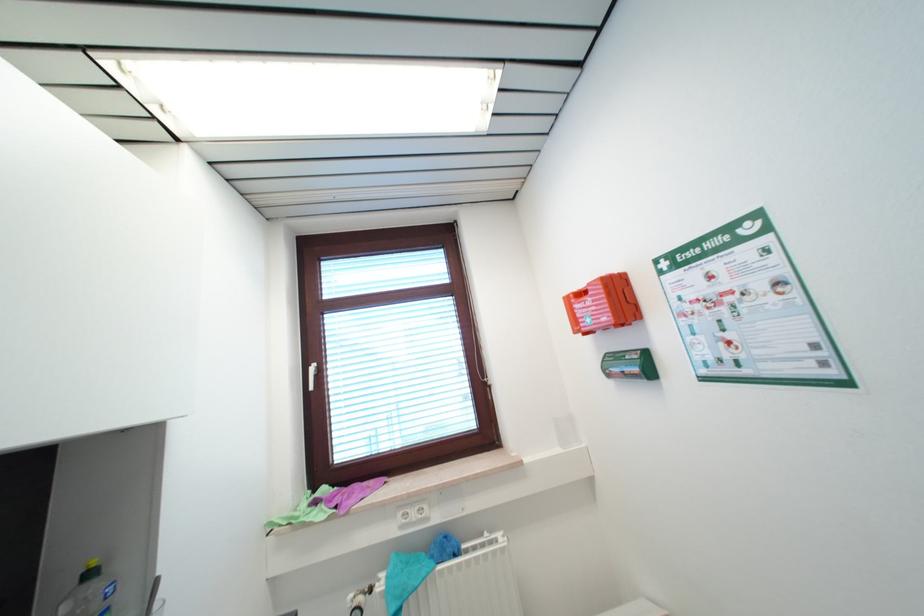
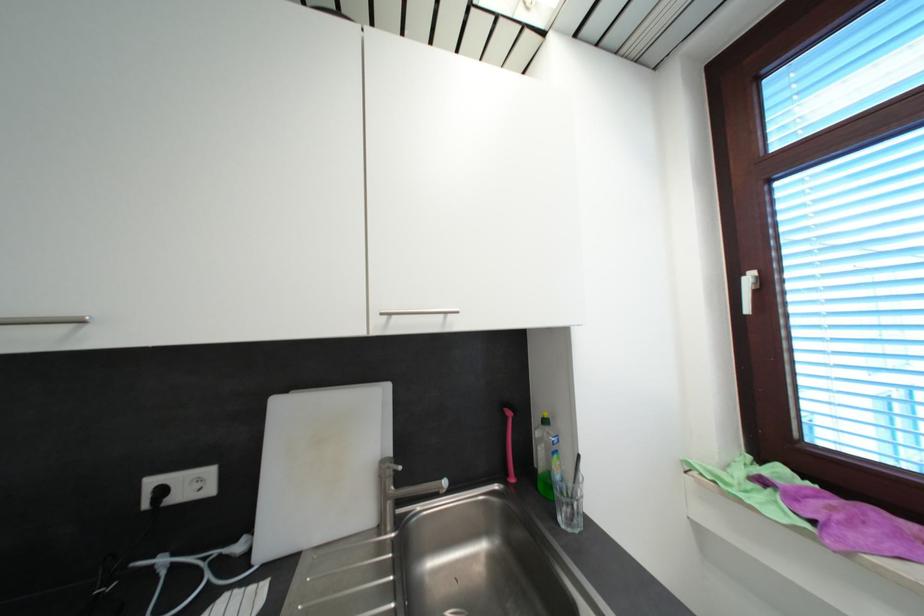
Question: Based on the continuous images, in which direction is the camera rotating? Reply with the corresponding letter.

Choices:
 (A) Left
 (B) Right
 (C) Up
 (D) Down

Answer: (A)